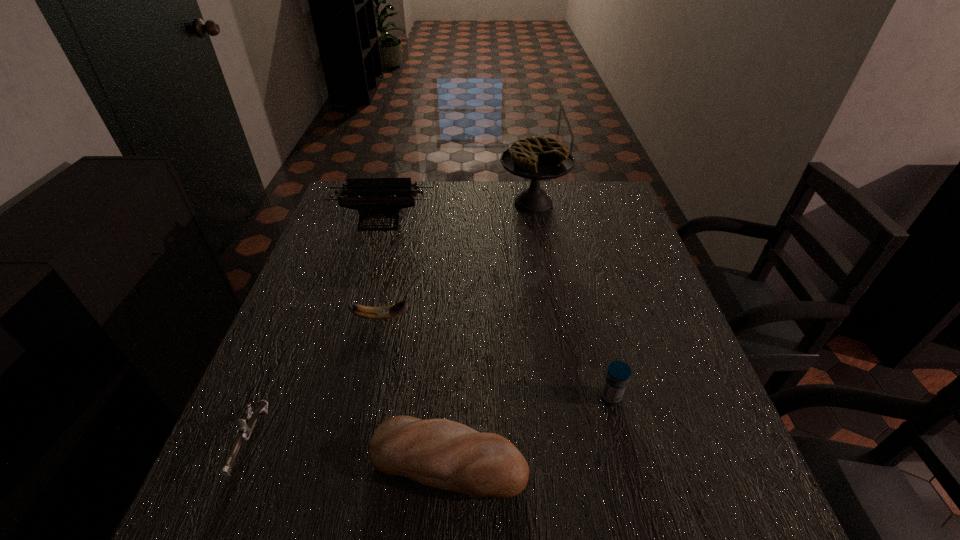
Where is `free space at the left edge of the desktop`? free space at the left edge of the desktop is located at coordinates (346, 332).

This screenshot has height=540, width=960. I want to click on vacant space at the right edge of the desktop, so click(590, 258).

This screenshot has width=960, height=540. In the image, there is a desktop. Find the location of `vacant space at the far left corner`. vacant space at the far left corner is located at coordinates (340, 217).

Image resolution: width=960 pixels, height=540 pixels. In order to click on free space at the far right corner of the desktop in this screenshot , I will do `click(597, 202)`.

Where is `empty space that is in between the bread and the medicine`? The height and width of the screenshot is (540, 960). empty space that is in between the bread and the medicine is located at coordinates (530, 428).

Where is `free space between the banana and the pie`? free space between the banana and the pie is located at coordinates (457, 260).

Locate an element on the screen. The image size is (960, 540). vacant space that's between the pie and the fourth nearest object is located at coordinates (457, 260).

Where is `free point between the pie and the medicine`? free point between the pie and the medicine is located at coordinates point(572,300).

Locate an element on the screen. This screenshot has width=960, height=540. vacant area that lies between the banana and the typewriter is located at coordinates (381, 268).

Where is `free spot between the bread and the gun`? Image resolution: width=960 pixels, height=540 pixels. free spot between the bread and the gun is located at coordinates (349, 451).